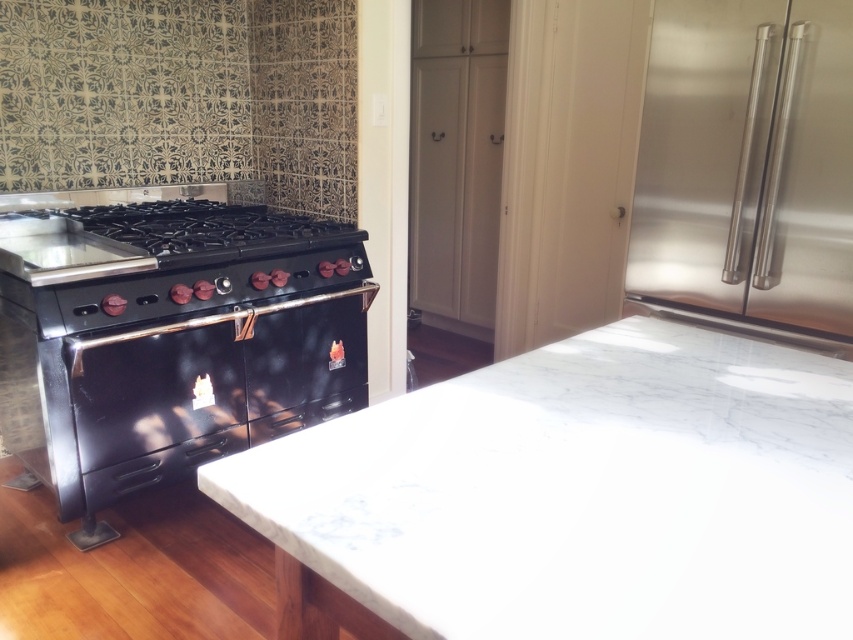
Looking at this image, which of these two, white marble countertop at center or black glossy oven at center, stands taller?

Standing taller between the two is black glossy oven at center.

Can you confirm if white marble countertop at center is thinner than black glossy oven at center?

No, white marble countertop at center is not thinner than black glossy oven at center.

What do you see at coordinates (581, 493) in the screenshot? I see `white marble countertop at center` at bounding box center [581, 493].

Locate an element on the screen. white marble countertop at center is located at coordinates (581, 493).

Based on the photo, is the position of stainless steel refrigerator at right more distant than that of black glossy oven at center?

No, it is not.

This screenshot has width=853, height=640. In order to click on stainless steel refrigerator at right in this screenshot , I will do [x=747, y=163].

In order to click on stainless steel refrigerator at right in this screenshot , I will do click(x=747, y=163).

Is point (584, 474) closer to camera compared to point (688, 28)?

Yes, point (584, 474) is in front of point (688, 28).

Does point (544, 460) lie behind point (782, 288)?

No, (544, 460) is closer to viewer.

Measure the distance between point (635, 342) and camera.

Point (635, 342) and camera are 4.92 feet apart.

Locate an element on the screen. Image resolution: width=853 pixels, height=640 pixels. white marble countertop at center is located at coordinates (581, 493).